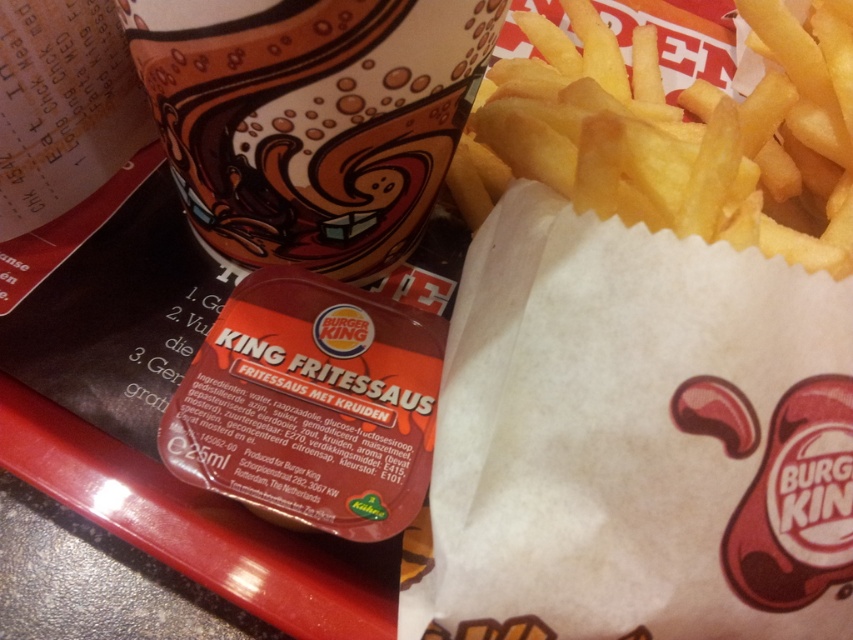
You are a customer at Burger King who wants to pour sauce into the matte ceramic cup at upper center. The golden crispy french fries at upper right are in the way. Can you move the fries to make space?

The matte ceramic cup at upper center is shorter than golden crispy french fries at upper right, so the fries are taller and might block access to the cup. Move the golden crispy french fries at upper right to create space for pouring sauce into the matte ceramic cup at upper center.

You are a customer at Burger King and you want to place your matte ceramic cup at upper center on the table without moving any other items. Where should you put it?

The matte ceramic cup at upper center is already placed at point coordinates [310,120], so you can leave it there.

Based on the photo, you are a customer at Burger King who wants to pour the sauce from the matte ceramic cup at upper center into the golden crispy french fries at upper right. Can you reach the cup before the fries?

The matte ceramic cup at upper center is located below the golden crispy french fries at upper right, so you can reach the cup first before the fries.